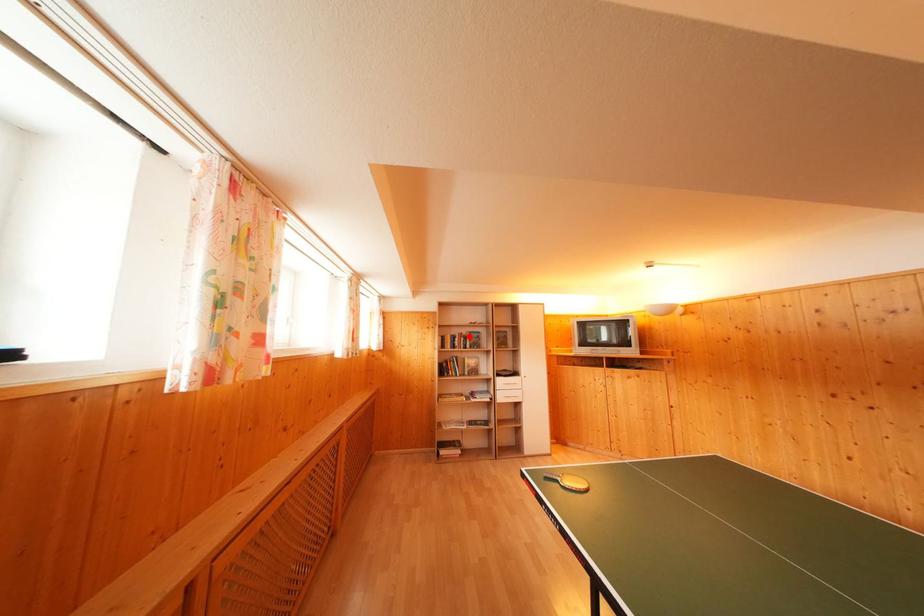
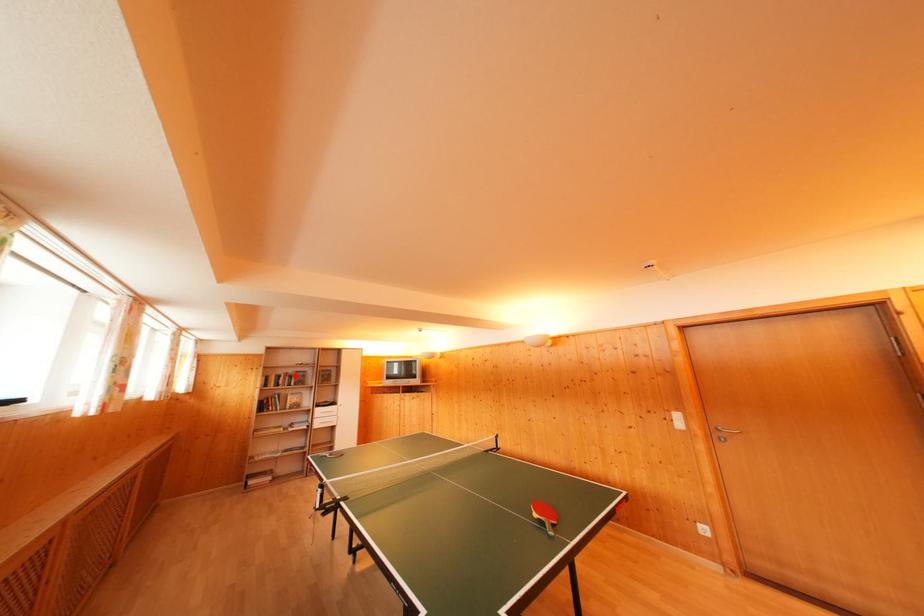
I am providing you with two images of the same scene from different viewpoints. A red point is marked on the first image and another point is marked on the second image. Is the marked point in image1 the same physical position as the marked point in image2?

Yes